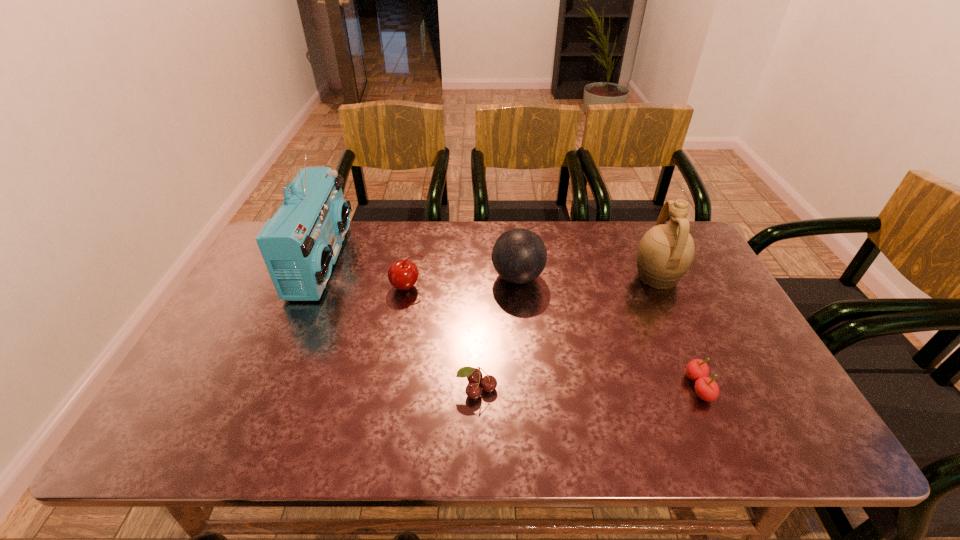
Find the location of a particular element. The image size is (960, 540). object positioned at the right edge is located at coordinates (665, 253).

The image size is (960, 540). Identify the location of object situated at the far left corner. (300, 244).

Image resolution: width=960 pixels, height=540 pixels. I want to click on object that is at the far right corner, so click(665, 253).

Identify the location of vacant space at the far edge. The width and height of the screenshot is (960, 540). (420, 228).

The height and width of the screenshot is (540, 960). What are the coordinates of `free space at the near edge of the desktop` in the screenshot? It's located at (289, 427).

Where is `free location at the left edge`? free location at the left edge is located at coordinates (173, 399).

You are a GUI agent. You are given a task and a screenshot of the screen. Output one action in this format:
    pyautogui.click(x=<x>, y=<y>)
    Task: Click on the free space at the right edge
    This screenshot has height=540, width=960.
    Given the screenshot: What is the action you would take?
    pyautogui.click(x=707, y=307)

Where is `blank region between the third tallest object and the radio receiver`? The image size is (960, 540). blank region between the third tallest object and the radio receiver is located at coordinates (420, 269).

Image resolution: width=960 pixels, height=540 pixels. What are the coordinates of `empty space that is in between the second cherry from left to right and the radio receiver` in the screenshot? It's located at (399, 325).

You are a GUI agent. You are given a task and a screenshot of the screen. Output one action in this format:
    pyautogui.click(x=<x>, y=<y>)
    Task: Click on the free space between the rightmost cherry and the second cherry from left to right
    
    Given the screenshot: What is the action you would take?
    pyautogui.click(x=588, y=388)